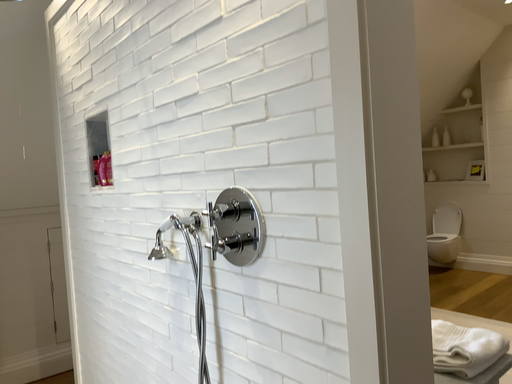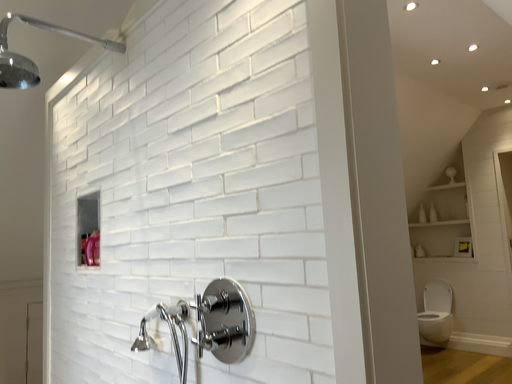
Question: Which way did the camera rotate in the video?

Choices:
 (A) rotated upward
 (B) rotated downward

Answer: (A)